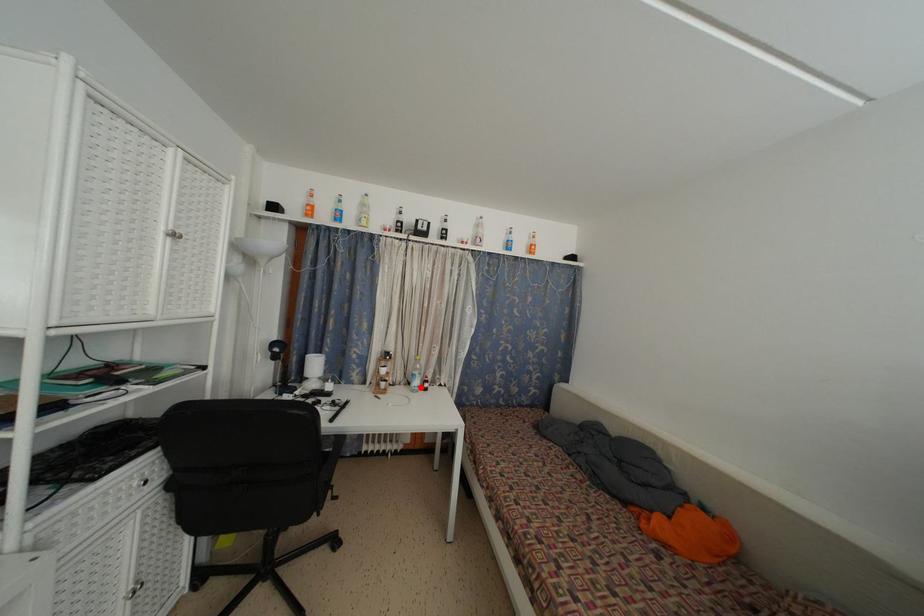
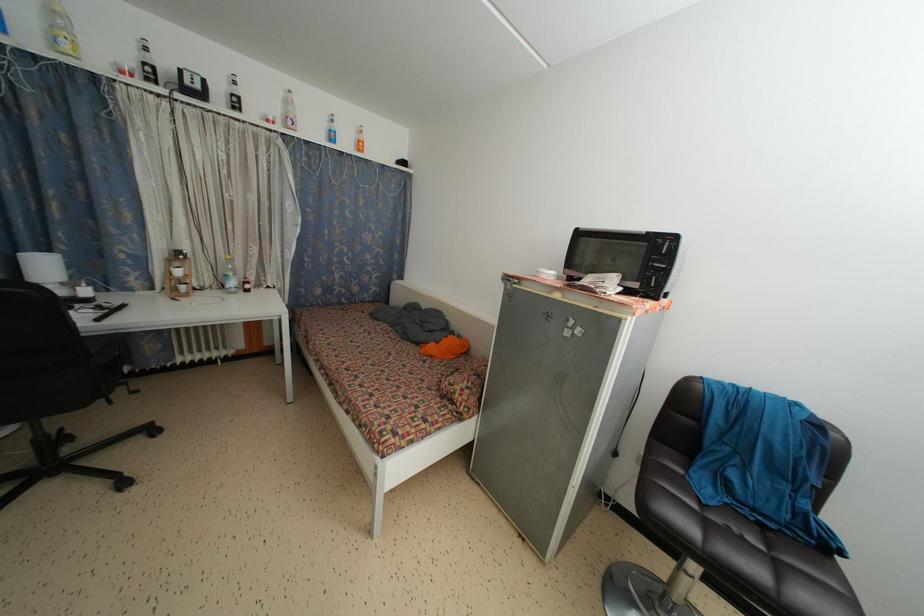
Question: I am providing you with two images of the same scene from different viewpoints. A red point is shown in image1. For the corresponding object point in image2, is it positioned nearer or farther from the camera?

Choices:
 (A) Nearer
 (B) Farther

Answer: (A)